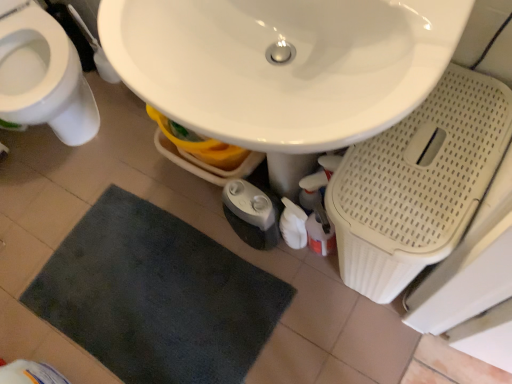
Where is `free space to the back side of dark gray plush bath mat at lower center`? This screenshot has width=512, height=384. free space to the back side of dark gray plush bath mat at lower center is located at coordinates (106, 176).